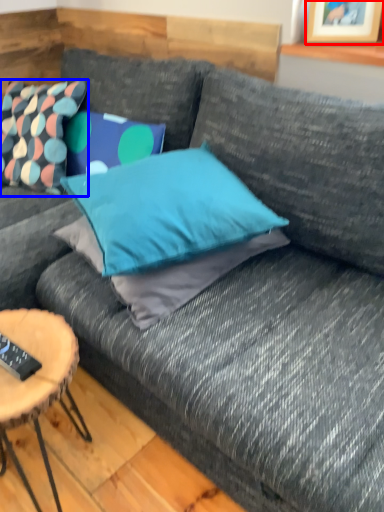
Question: Which of the following is the farthest to the observer, picture frame (highlighted by a red box) or pillow (highlighted by a blue box)?

Choices:
 (A) picture frame
 (B) pillow

Answer: (B)